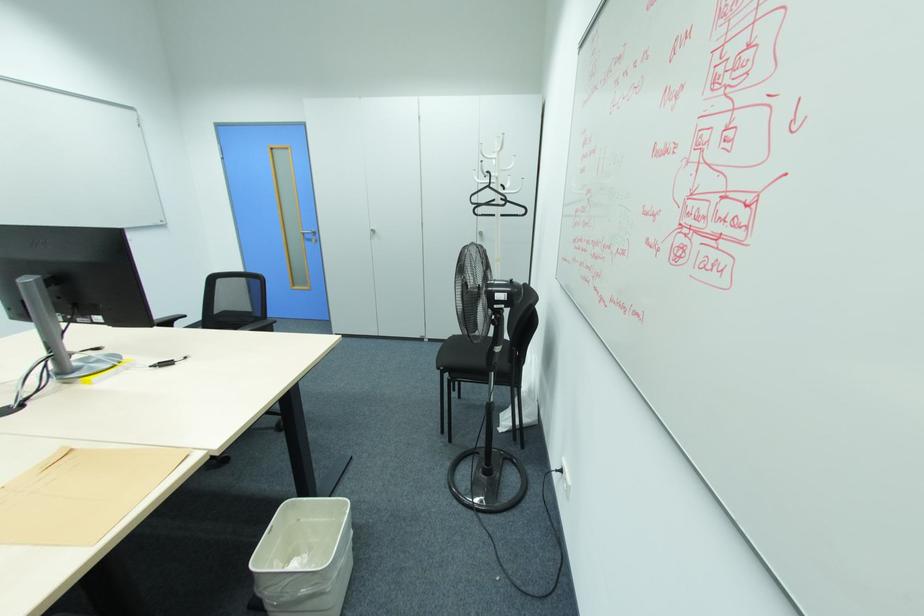
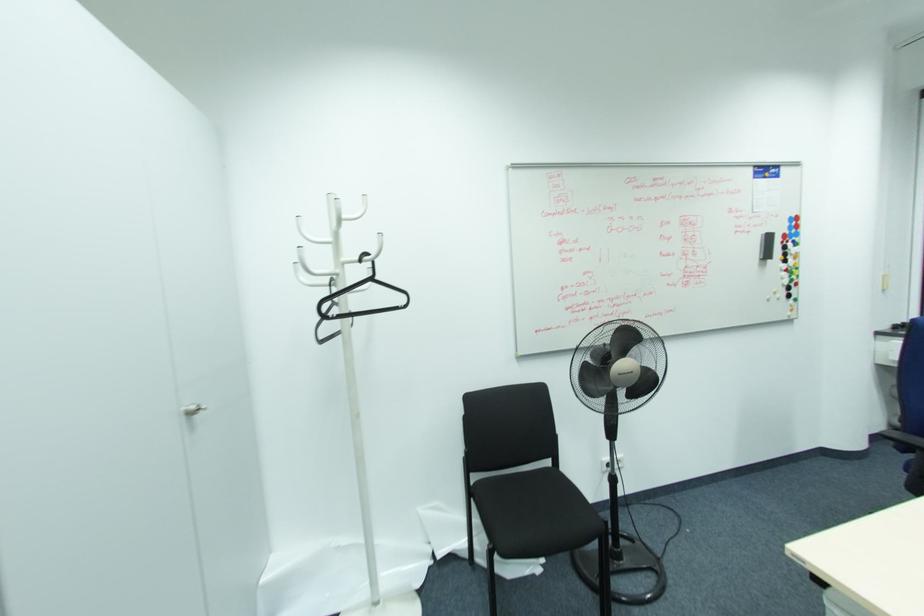
Where in the second image is the point corresponding to (x=490, y=187) from the first image?

(371, 280)